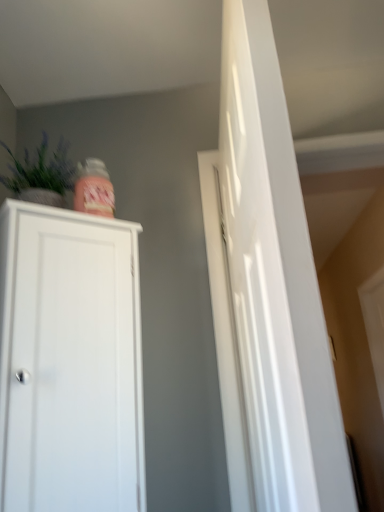
Question: Considering the positions of white matte cabinet at left and glossy white door at right in the image, is white matte cabinet at left wider or thinner than glossy white door at right?

Choices:
 (A) wide
 (B) thin

Answer: (A)

Question: Choose the correct answer: Is white matte cabinet at left inside glossy white door at right or outside it?

Choices:
 (A) inside
 (B) outside

Answer: (B)

Question: Based on their relative distances, which object is farther from the white matte cabinet at left?

Choices:
 (A) green matte vase at upper left
 (B) glossy white door at right

Answer: (B)

Question: Which object is positioned closest to the green matte vase at upper left?

Choices:
 (A) glossy white door at right
 (B) white matte cabinet at left

Answer: (B)